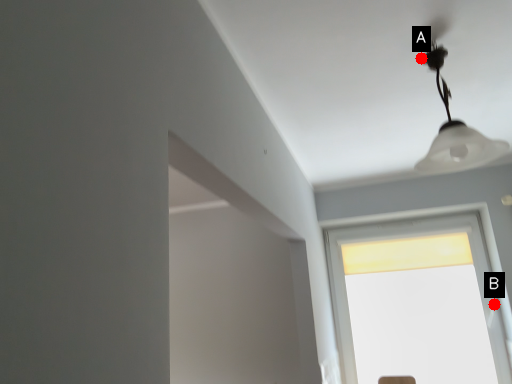
Question: Two points are circled on the image, labeled by A and B beside each circle. Which of the following is the farthest from the observer?

Choices:
 (A) A is further
 (B) B is further

Answer: (B)